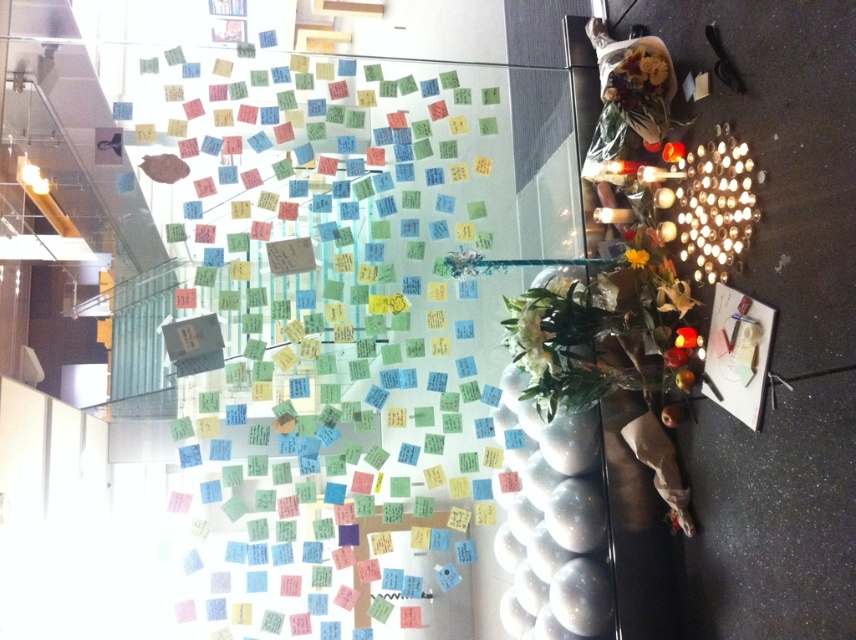
Question: Is colorful paper notes at center to the left of yellow matte flower at upper center from the viewer's perspective?

Choices:
 (A) no
 (B) yes

Answer: (B)

Question: Which point appears farthest from the camera in this image?

Choices:
 (A) (352, 308)
 (B) (645, 253)

Answer: (A)

Question: Can you confirm if colorful paper notes at center is bigger than yellow matte flower at upper center?

Choices:
 (A) yes
 (B) no

Answer: (A)

Question: Does colorful paper notes at center have a lesser width compared to yellow matte flower at upper center?

Choices:
 (A) no
 (B) yes

Answer: (A)